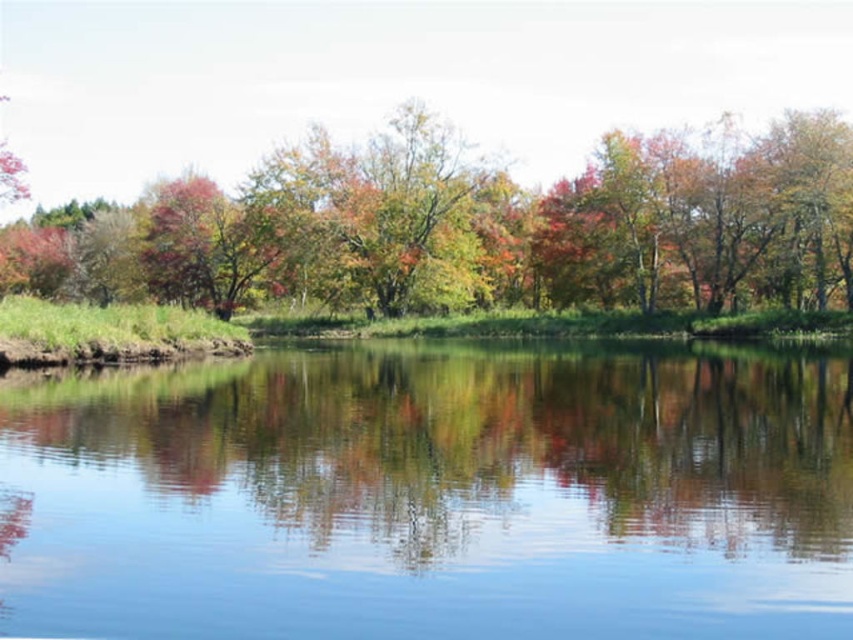
Question: Is clear water at center closer to camera compared to multicolored foliage at center?

Choices:
 (A) no
 (B) yes

Answer: (B)

Question: Which point is farther to the camera?

Choices:
 (A) clear water at center
 (B) multicolored foliage at center

Answer: (B)

Question: Does clear water at center appear on the left side of multicolored foliage at center?

Choices:
 (A) yes
 (B) no

Answer: (B)

Question: In this image, where is clear water at center located relative to multicolored foliage at center?

Choices:
 (A) right
 (B) left

Answer: (A)

Question: Which of the following is the closest to the observer?

Choices:
 (A) multicolored foliage at center
 (B) clear water at center

Answer: (B)